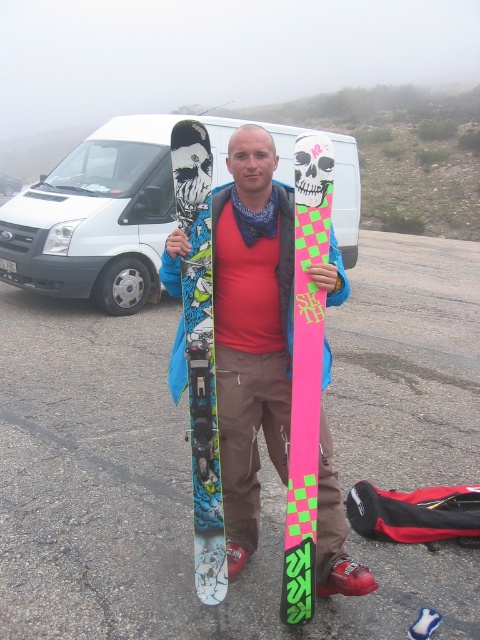
Question: Where is matte pink plastic skull at center located in relation to white matte van at upper left in the image?

Choices:
 (A) above
 (B) below

Answer: (B)

Question: Among these objects, which one is farthest from the camera?

Choices:
 (A) white matte van at upper left
 (B) black matte skull at center
 (C) matte plastic skis at center
 (D) matte pink plastic skull at center

Answer: (A)

Question: Estimate the real-world distances between objects in this image. Which object is closer to the black matte skull at center?

Choices:
 (A) matte blue snowboard at center
 (B) pink matte snowboard at center
 (C) white matte van at upper left
 (D) white matte van at upper center

Answer: (A)

Question: Does matte plastic skis at center have a smaller size compared to matte pink plastic skull at center?

Choices:
 (A) no
 (B) yes

Answer: (A)

Question: Is black matte skull at center below white matte van at upper left?

Choices:
 (A) no
 (B) yes

Answer: (B)

Question: Among these objects, which one is nearest to the camera?

Choices:
 (A) matte plastic skis at center
 (B) pink matte snowboard at center

Answer: (B)